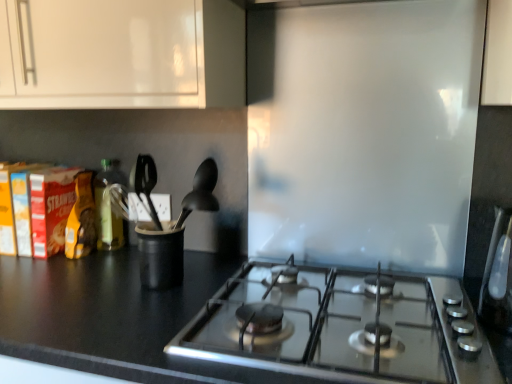
This screenshot has width=512, height=384. Find the location of `vacant space that is to the left of black plastic utensil holder at center`. vacant space that is to the left of black plastic utensil holder at center is located at coordinates (84, 280).